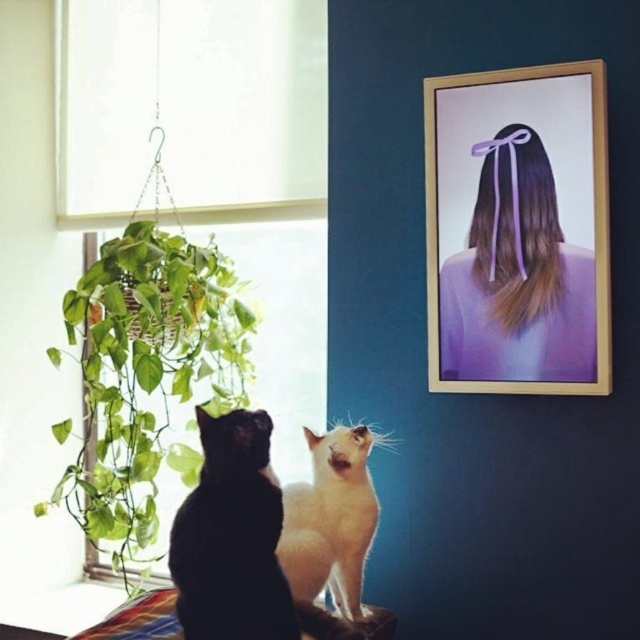
You are an interior designer planning to place a new decorative item between the wooden frame at upper right and the green leafy plant at left. Given their sizes, which object should you consider moving to accommodate the new item?

The wooden frame at upper right has a smaller width than the green leafy plant at left, so you should consider moving the wooden frame at upper right to make space for the new item.

You are a cat sitting between the wooden frame at upper right and the green leafy plant at left. Which object is closer to your right side?

The wooden frame at upper right is closer to your right side because it is positioned to the right of the green leafy plant at left.

You are a photographer trying to capture the cats in the scene. To ensure proper lighting, you need to know the exact position of the light source. Based on the scene description, where is the light source located relative to the white fabric at upper left?

The light source is located above the white fabric at upper left because the white blind partially covering the window allows natural light to filter in, and the white fabric is positioned at the upper left corner, indicating the light originates from that direction.